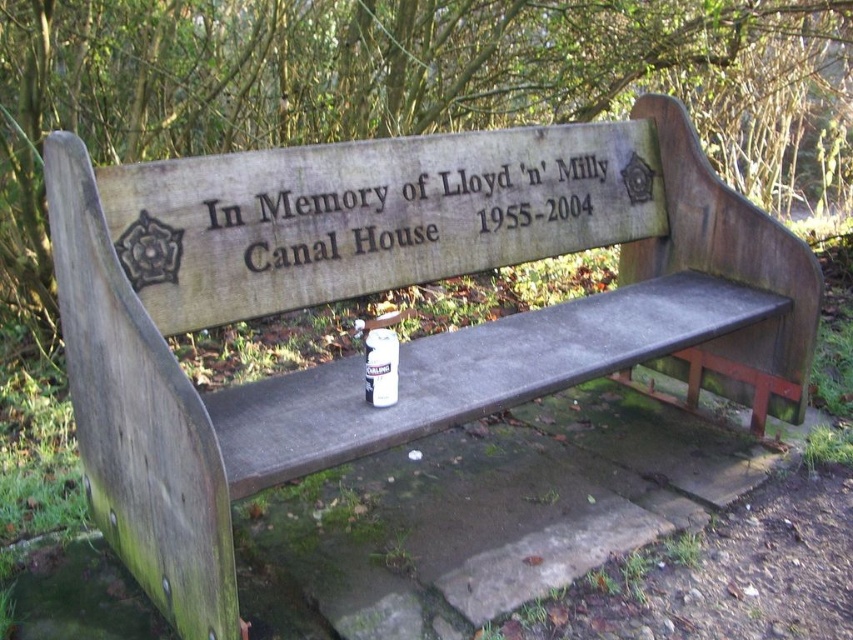
Can you confirm if black engraved text at center is positioned above white matte can at center?

Yes, black engraved text at center is above white matte can at center.

From the picture: Between black engraved text at center and white matte can at center, which one is positioned lower?

white matte can at center is below.

Where is `black engraved text at center`? Image resolution: width=853 pixels, height=640 pixels. black engraved text at center is located at coordinates (401, 209).

Identify the location of black engraved text at center. (401, 209).